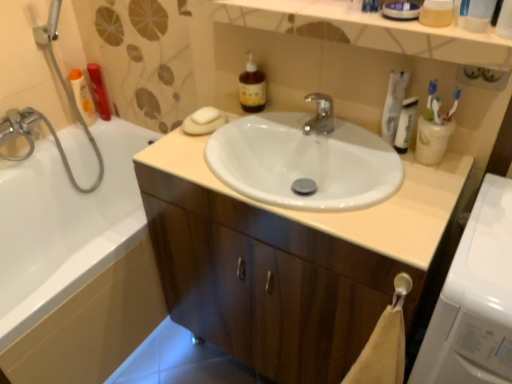
Identify the location of free location to the left of white glossy tube at upper right. (342, 140).